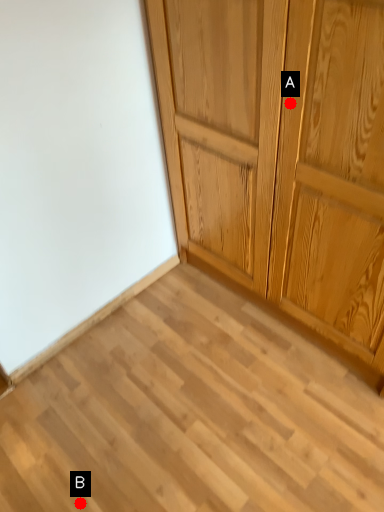
Question: Two points are circled on the image, labeled by A and B beside each circle. Among these points, which one is farthest from the camera?

Choices:
 (A) A is further
 (B) B is further

Answer: (B)